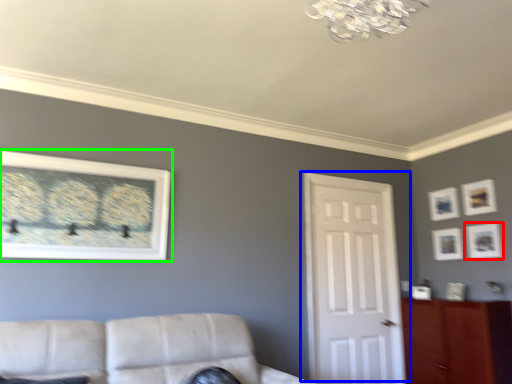
Question: Which object is positioned farthest from picture frame (highlighted by a red box)? Select from door (highlighted by a blue box) and picture frame (highlighted by a green box).

Choices:
 (A) door
 (B) picture frame

Answer: (B)